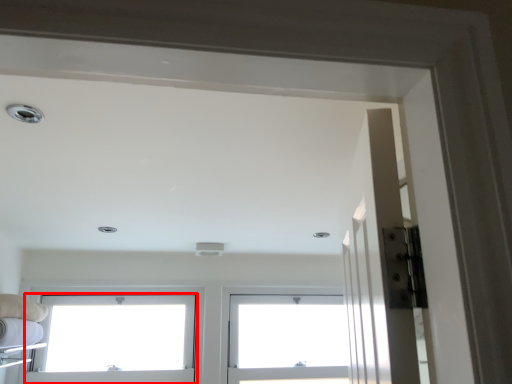
Question: From the image's perspective, where is window (annotated by the red box) located relative to window?

Choices:
 (A) above
 (B) below

Answer: (A)